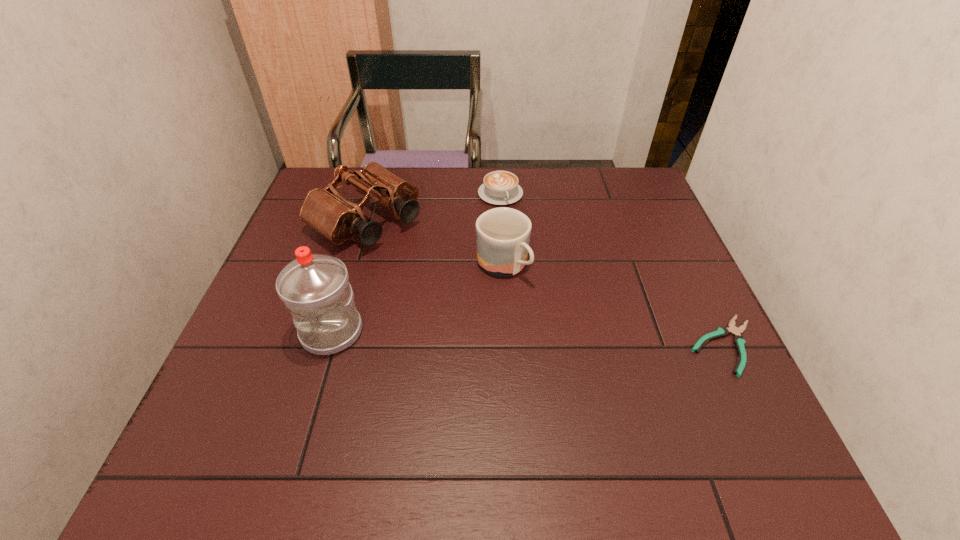
Locate an element on the screen. This screenshot has height=540, width=960. free space located 0.190m through the eyepieces of the binoculars is located at coordinates (452, 279).

Identify the location of vacant space situated on the side with the handle of the mug. This screenshot has width=960, height=540. (635, 397).

Where is `vacant space situated 0.050m on the side with the handle of the mug`? vacant space situated 0.050m on the side with the handle of the mug is located at coordinates (532, 297).

Identify the location of free space located on the side with the handle of the mug. This screenshot has height=540, width=960. (623, 386).

In order to click on vacant space located on the side of the cappuccino with the handle in this screenshot , I will do `click(530, 248)`.

The image size is (960, 540). I want to click on vacant space located 0.110m on the side of the cappuccino with the handle, so click(520, 230).

Image resolution: width=960 pixels, height=540 pixels. What are the coordinates of `free spot located on the side of the cappuccino with the handle` in the screenshot? It's located at (540, 266).

The width and height of the screenshot is (960, 540). Identify the location of binoculars at the far edge. (325, 210).

In order to click on cappuccino at the far edge in this screenshot , I will do `click(500, 187)`.

This screenshot has height=540, width=960. In order to click on water bottle that is at the left edge in this screenshot , I will do `click(315, 288)`.